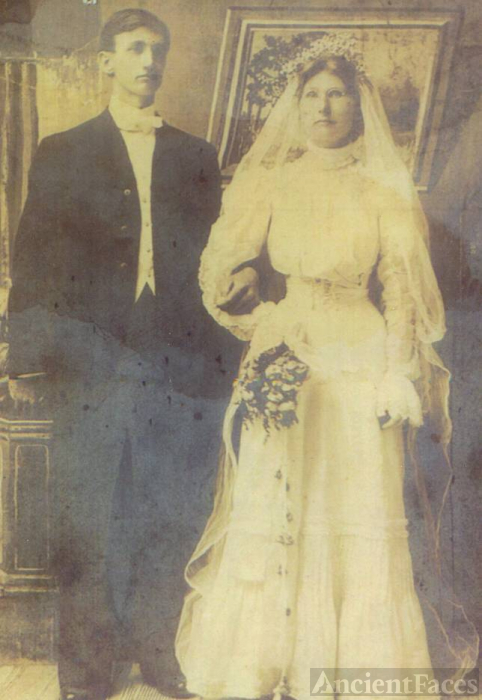
You are a GUI agent. You are given a task and a screenshot of the screen. Output one action in this format:
    pyautogui.click(x=<x>, y=<y>)
    Task: Click on the picture frame
    This screenshot has height=700, width=482.
    Given the screenshot: What is the action you would take?
    pyautogui.click(x=236, y=17)